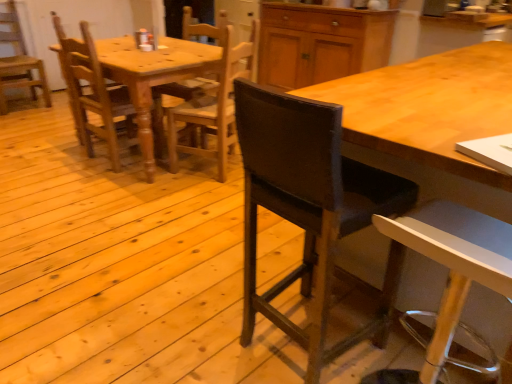
The width and height of the screenshot is (512, 384). I want to click on vacant space in front of wooden chair at center, which appears as the second chair when viewed from the back, so coord(96,183).